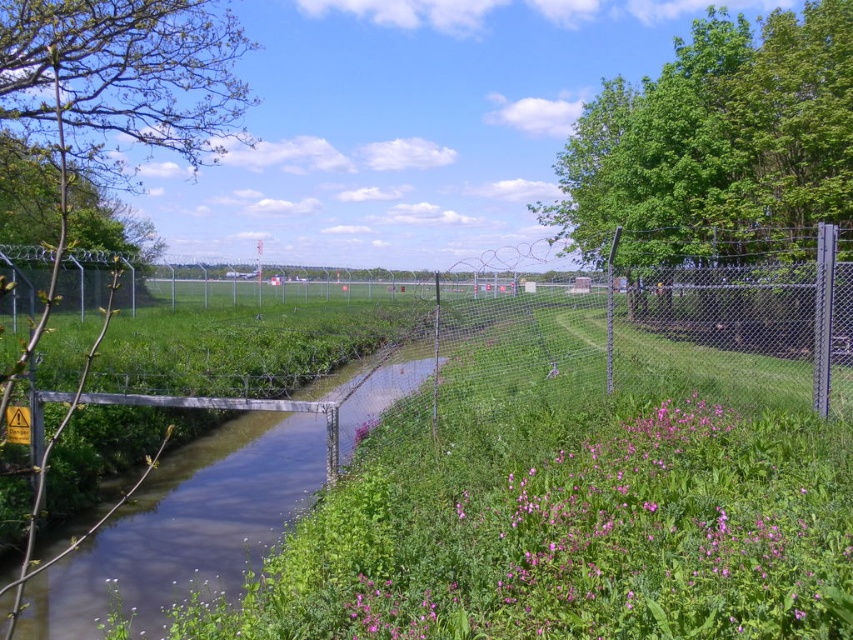
This screenshot has height=640, width=853. What do you see at coordinates (717, 144) in the screenshot?
I see `green leafy tree at upper right` at bounding box center [717, 144].

Which is behind, point (766, 26) or point (86, 99)?

Point (766, 26)

Where is `green leafy tree at upper right`? This screenshot has height=640, width=853. green leafy tree at upper right is located at coordinates (717, 144).